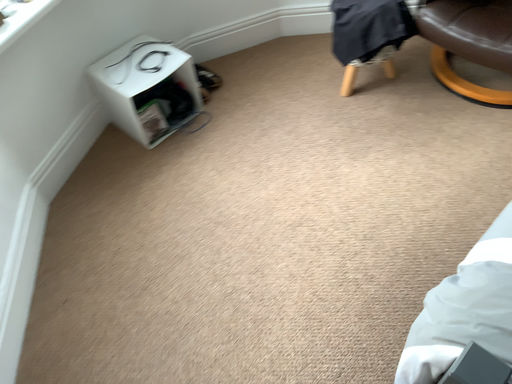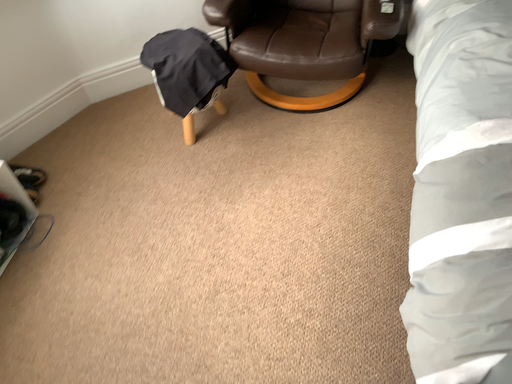
Question: Which way did the camera rotate in the video?

Choices:
 (A) rotated upward
 (B) rotated downward

Answer: (A)